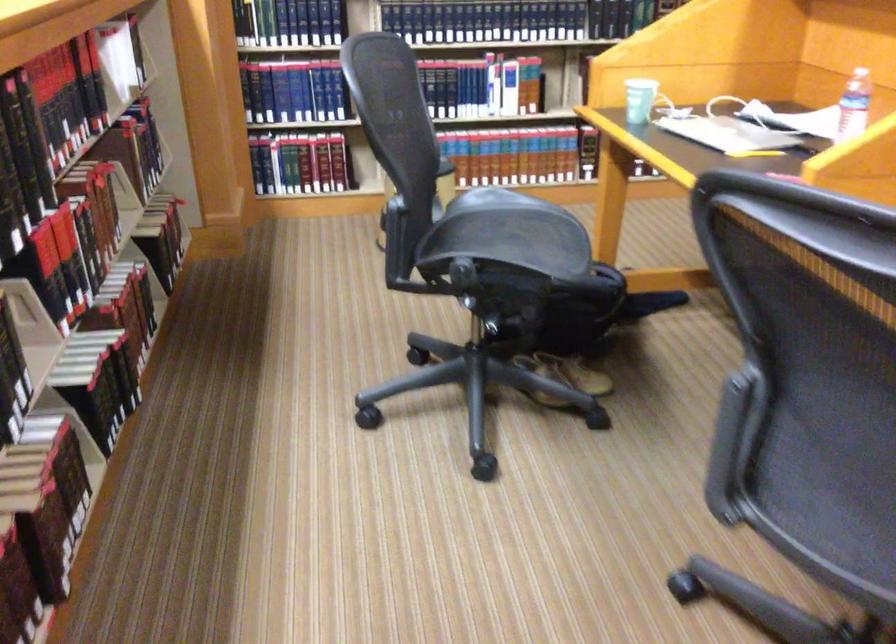
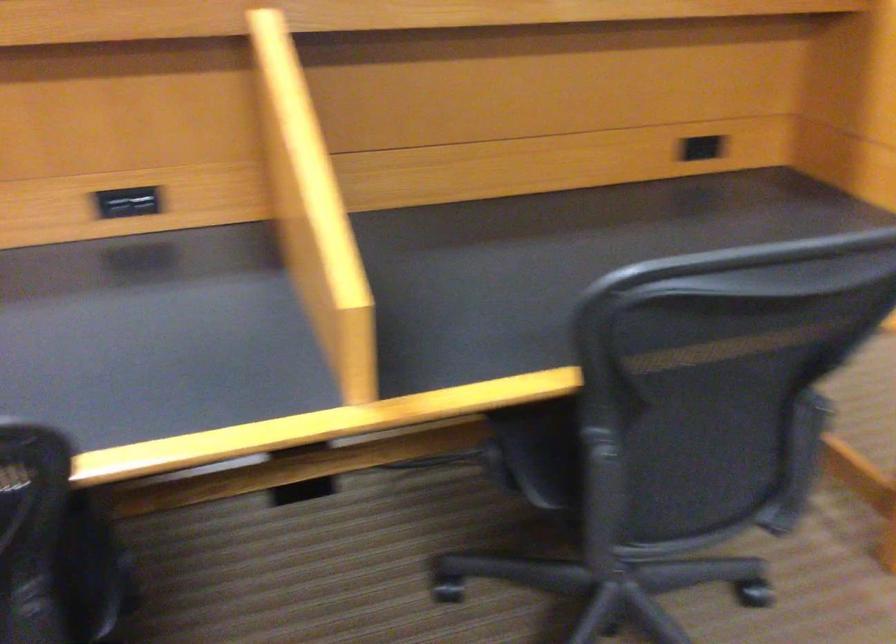
Question: I am providing you with two images of the same scene from different viewpoints. After the viewpoint changes to image2, which objects are now occluded?

Choices:
 (A) black power outlet
 (B) light switch rocker
 (C) plastic water bottle
 (D) chair armrest

Answer: (C)